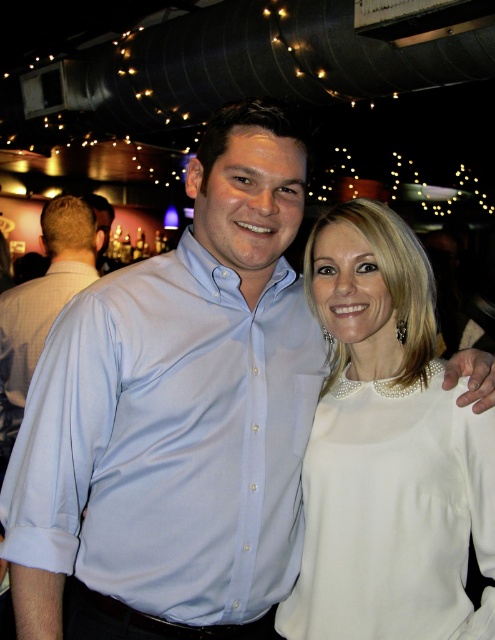
Who is shorter, light blue satin shirt at center or white satin blouse at center?

light blue satin shirt at center is shorter.

Which is behind, point (224, 316) or point (333, 273)?

The point (333, 273) is more distant.

You are a GUI agent. You are given a task and a screenshot of the screen. Output one action in this format:
    pyautogui.click(x=<x>, y=<y>)
    Task: Click on the light blue satin shirt at center
    
    Given the screenshot: What is the action you would take?
    pyautogui.click(x=169, y=440)

Does light blue satin shirt at center come behind light blue shirt at center?

No, light blue satin shirt at center is in front of light blue shirt at center.

Between light blue satin shirt at center and light blue shirt at center, which one is positioned higher?

light blue shirt at center

Is point (188, 300) in front of point (67, 234)?

Yes.

At what (x,y) coordinates should I click in order to perform the action: click on light blue satin shirt at center. Please return your answer as a coordinate pair (x, y). Looking at the image, I should click on (169, 440).

Is white satin blouse at center closer to camera compared to light blue shirt at center?

Yes, it is.

Does point (384, 598) come in front of point (30, 284)?

Yes, it is.

Where is `white satin blouse at center`? The height and width of the screenshot is (640, 495). white satin blouse at center is located at coordinates (388, 451).